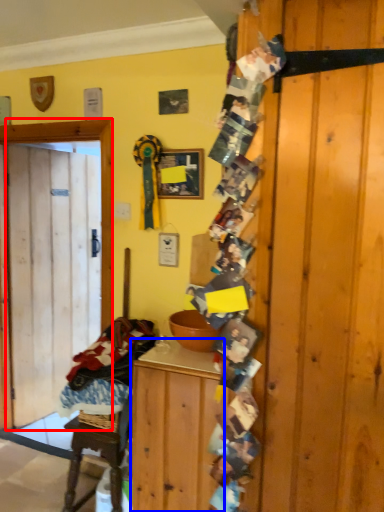
Question: Which object is further to the camera taking this photo, door (highlighted by a red box) or cabinetry (highlighted by a blue box)?

Choices:
 (A) door
 (B) cabinetry

Answer: (A)